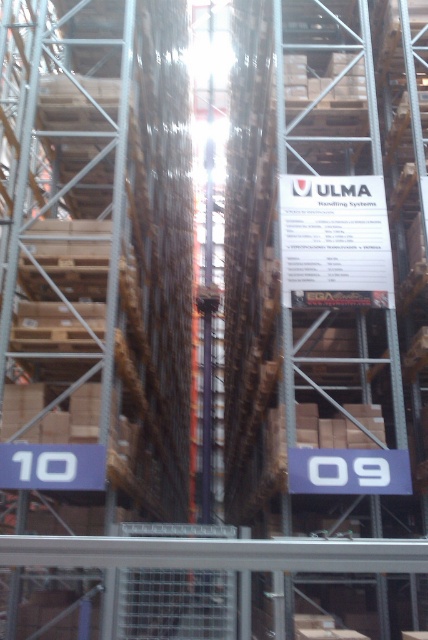
Which is above, white paper sign at center or white plastic sign at lower center?

white paper sign at center is above.

Can you confirm if white paper sign at center is smaller than white plastic sign at lower center?

No.

The width and height of the screenshot is (428, 640). Find the location of `white paper sign at center`. white paper sign at center is located at coordinates (335, 241).